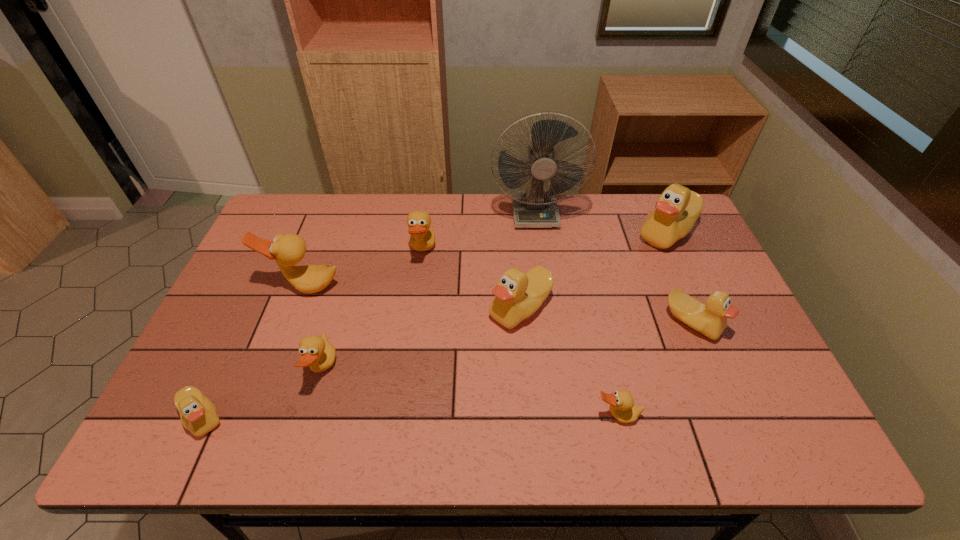
Where is `gray fan`? Image resolution: width=960 pixels, height=540 pixels. gray fan is located at coordinates click(534, 208).

The height and width of the screenshot is (540, 960). What are the coordinates of `the tallest object` in the screenshot? It's located at (534, 208).

At what (x,y) coordinates should I click in order to perform the action: click on the farthest beige duck. Please return your answer as a coordinate pair (x, y). Looking at the image, I should click on (676, 211).

In order to click on the third nearest tan duck in this screenshot , I will do `click(289, 249)`.

Find the location of a particular element. the third smallest beige duck is located at coordinates (518, 295).

Image resolution: width=960 pixels, height=540 pixels. Identify the location of the third beige duck from right to left. (518, 295).

Image resolution: width=960 pixels, height=540 pixels. In order to click on the second tan duck from right to left in this screenshot , I will do `click(422, 238)`.

At what (x,y) coordinates should I click in order to perform the action: click on the fourth object from left to right. Please return your answer as a coordinate pair (x, y). This screenshot has width=960, height=540. Looking at the image, I should click on (422, 238).

Where is `the second smallest beige duck`? This screenshot has width=960, height=540. the second smallest beige duck is located at coordinates (710, 319).

Image resolution: width=960 pixels, height=540 pixels. Find the location of `the third biggest tan duck`. the third biggest tan duck is located at coordinates (316, 352).